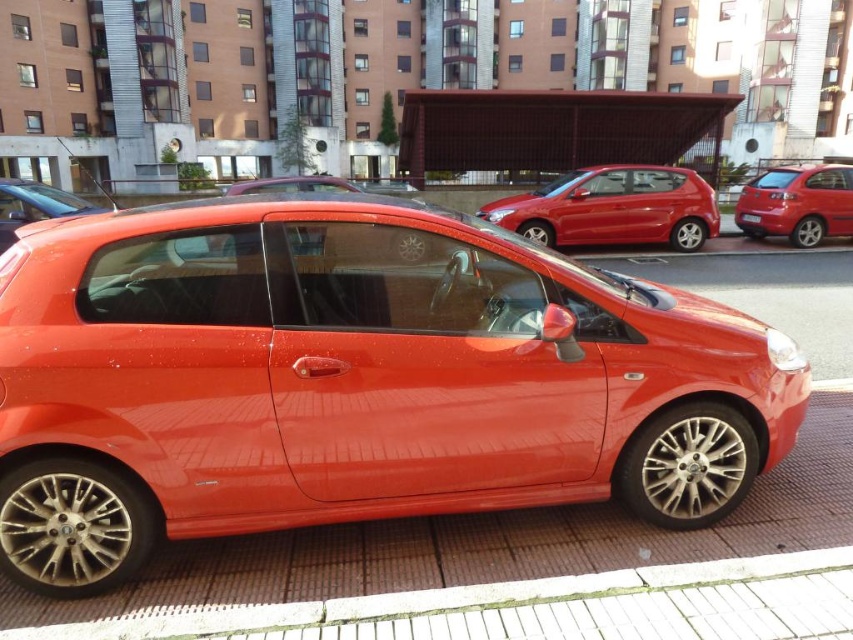
Question: Which point appears farthest from the camera in this image?

Choices:
 (A) (270, 296)
 (B) (299, 600)
 (C) (564, 218)
 (D) (758, 225)

Answer: (D)

Question: Which point appears closest to the camera in this image?

Choices:
 (A) (624, 179)
 (B) (129, 364)
 (C) (763, 602)
 (D) (73, 211)

Answer: (C)

Question: Can you confirm if white brick curb at lower center is positioned above glossy metallic car at center?

Choices:
 (A) yes
 (B) no

Answer: (B)

Question: Considering the real-world distances, which object is closest to the red plastic license plate at center?

Choices:
 (A) shiny metallic car at center
 (B) glossy red hatchback at right
 (C) glossy metallic car at center
 (D) brick pavement at center

Answer: (B)

Question: Is glossy red hatchback at right bigger than red plastic license plate at center?

Choices:
 (A) no
 (B) yes

Answer: (B)

Question: Does brick pavement at center appear on the right side of glossy red hatchback at center?

Choices:
 (A) yes
 (B) no

Answer: (B)